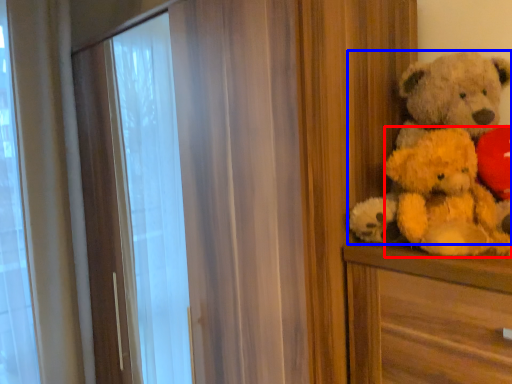
Question: Which of the following is the farthest to the observer, teddy (highlighted by a red box) or teddy bear (highlighted by a blue box)?

Choices:
 (A) teddy
 (B) teddy bear

Answer: (B)